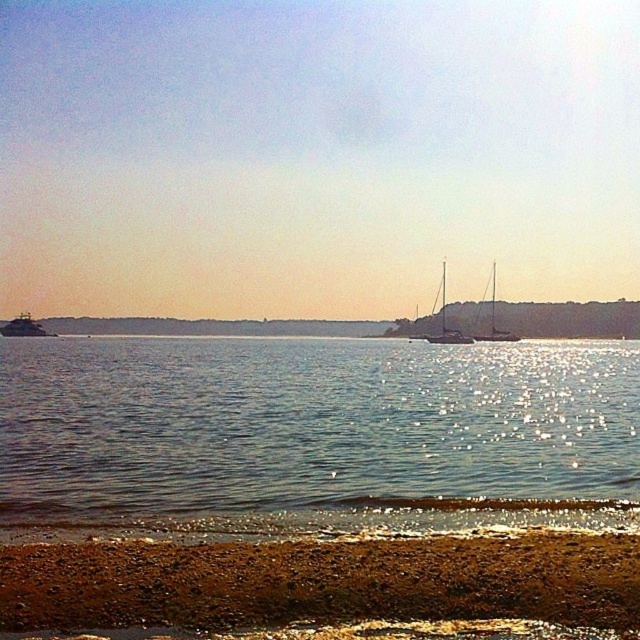
Question: Estimate the real-world distances between objects in this image. Which object is farther from the white matte sailboat at right?

Choices:
 (A) metallic silver boat at left
 (B) clear water at lower center
 (C) white matte sailboat at center

Answer: (A)

Question: Is white matte sailboat at center smaller than metallic silver boat at left?

Choices:
 (A) no
 (B) yes

Answer: (A)

Question: Is brown gravelly sand at lower center thinner than metallic silver boat at left?

Choices:
 (A) no
 (B) yes

Answer: (B)

Question: In this image, where is metallic silver boat at left located relative to white matte sailboat at right?

Choices:
 (A) left
 (B) right

Answer: (A)

Question: Which point is farther to the camera?

Choices:
 (A) (0, 326)
 (B) (529, 352)

Answer: (A)

Question: Which point appears farthest from the camera in this image?

Choices:
 (A) (225, 381)
 (B) (484, 339)
 (C) (316, 605)

Answer: (B)